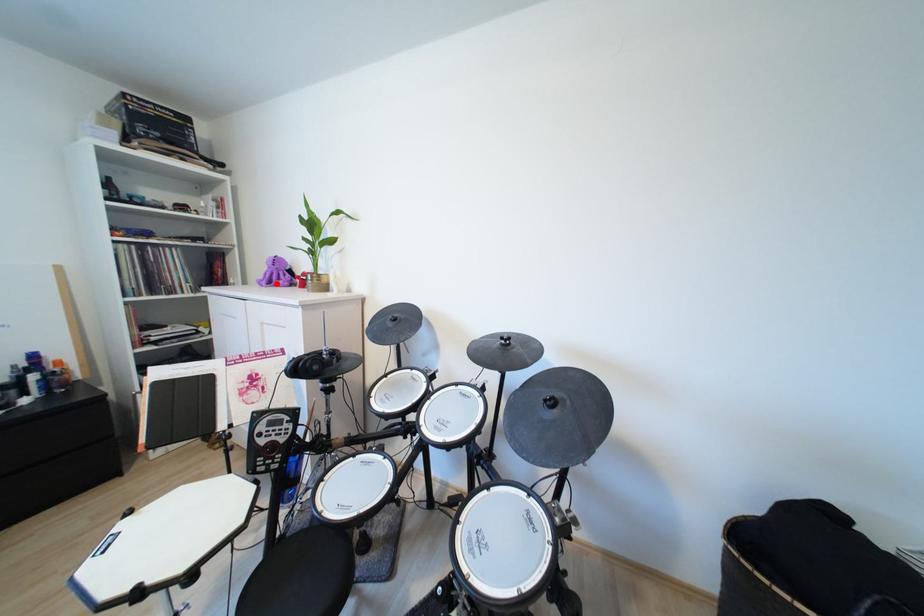
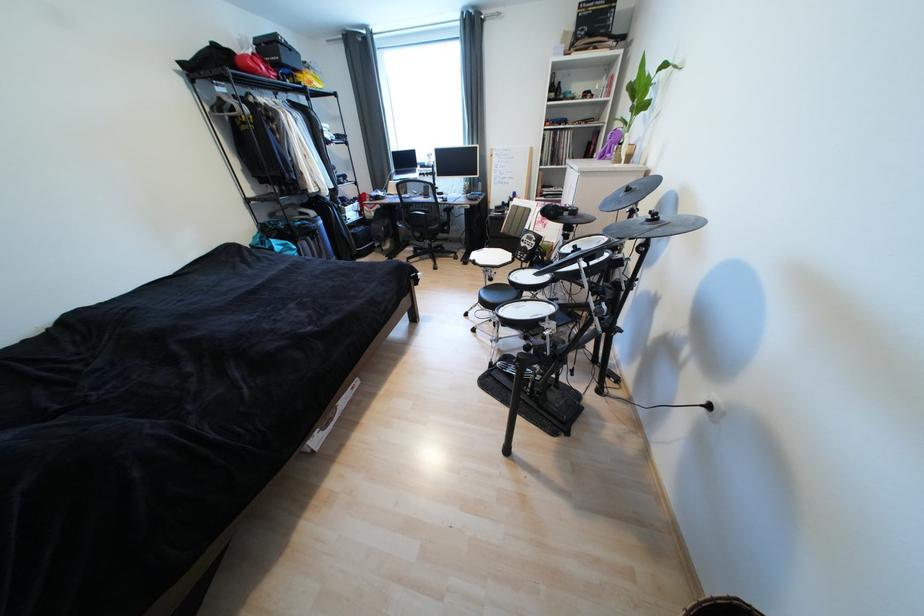
The point at the highlighted location is marked in the first image. Where is the corresponding point in the second image?

(609, 156)